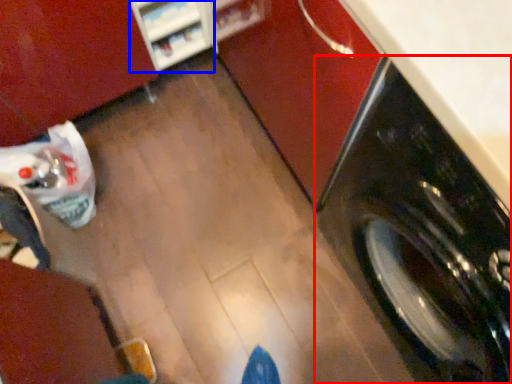
Question: Which object is closer to the camera taking this photo, washing machine (highlighted by a red box) or shelf (highlighted by a blue box)?

Choices:
 (A) washing machine
 (B) shelf

Answer: (A)